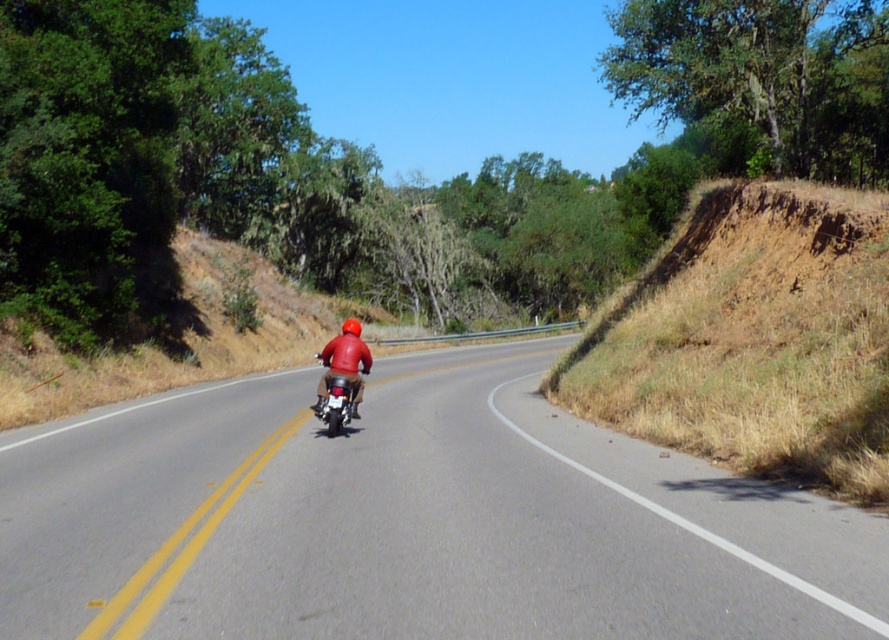
Question: Is dry grass at right wider than shiny chrome motorcycle at center?

Choices:
 (A) yes
 (B) no

Answer: (A)

Question: Which point is farther from the camera taking this photo?

Choices:
 (A) (327, 369)
 (B) (119, 461)
 (C) (322, 403)

Answer: (A)

Question: Is dry grass at right smaller than shiny chrome motorcycle at center?

Choices:
 (A) yes
 (B) no

Answer: (B)

Question: Among these objects, which one is nearest to the camera?

Choices:
 (A) matte red helmet at center
 (B) shiny chrome motorcycle at center
 (C) gray asphalt road at center

Answer: (C)

Question: Can you confirm if dry grass at right is smaller than shiny chrome motorcycle at center?

Choices:
 (A) no
 (B) yes

Answer: (A)

Question: Among these objects, which one is nearest to the camera?

Choices:
 (A) dry grass at right
 (B) shiny chrome motorcycle at center

Answer: (A)